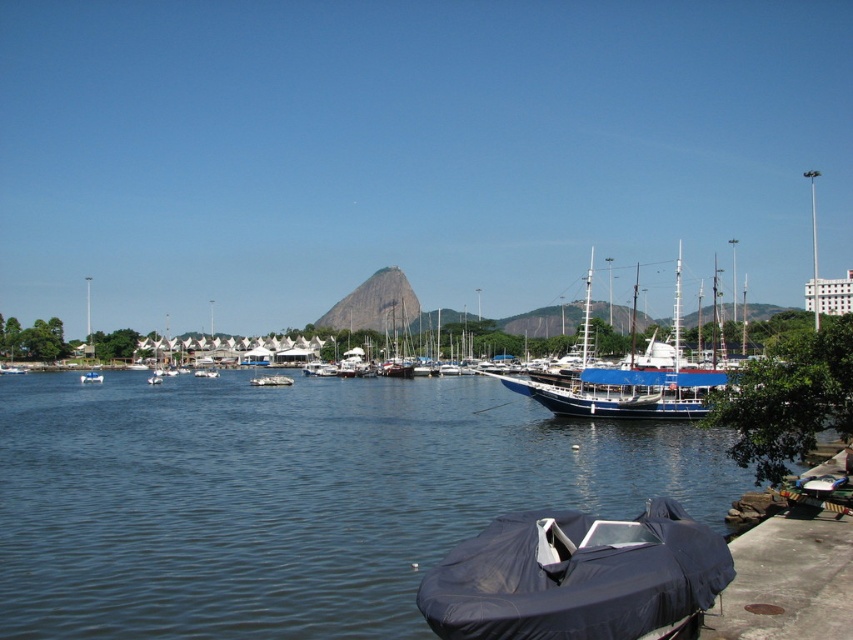
Question: Does white matte boat at center appear on the right side of white plastic boat at center?

Choices:
 (A) no
 (B) yes

Answer: (B)

Question: Can you confirm if green rock at center is positioned below white matte boat at center?

Choices:
 (A) no
 (B) yes

Answer: (A)

Question: Which object is the closest to the blue polished wood sailboat at center?

Choices:
 (A) blue water at lower left
 (B) green rock at center
 (C) dark blue tarpaulin boat at lower center
 (D) white matte boat at center

Answer: (C)

Question: Which point is closer to the camera?

Choices:
 (A) click(387, 385)
 (B) click(646, 554)

Answer: (B)

Question: From the image, what is the correct spatial relationship of dark blue tarpaulin boat at lower center in relation to white plastic boat at center?

Choices:
 (A) left
 (B) right

Answer: (B)

Question: Which point is closer to the camera?

Choices:
 (A) white matte boat at center
 (B) dark blue tarpaulin boat at lower center
 (C) blue polished wood sailboat at center
 (D) green rock at center

Answer: (B)